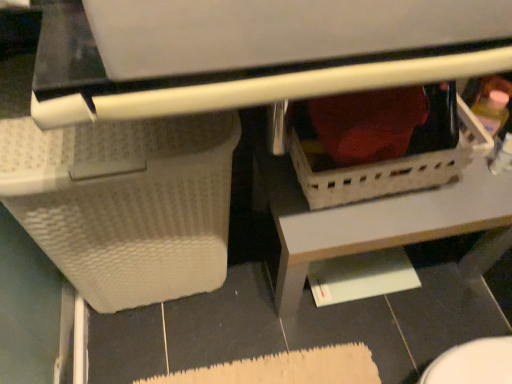
Question: Should I look upward or downward to see white textured basket at lower left, which appears as the second basket when viewed from the right?

Choices:
 (A) up
 (B) down

Answer: (B)

Question: From the image's perspective, is white textured basket at lower left, marked as the first basket in a left-to-right arrangement, over white plastic basket at center, positioned as the first basket in right-to-left order?

Choices:
 (A) no
 (B) yes

Answer: (A)

Question: Can you confirm if white textured basket at lower left, which appears as the second basket when viewed from the right, is thinner than white plastic basket at center, positioned as the first basket in right-to-left order?

Choices:
 (A) no
 (B) yes

Answer: (A)

Question: Can you confirm if white textured basket at lower left, marked as the first basket in a left-to-right arrangement, is positioned to the left of white plastic basket at center, positioned as the first basket in right-to-left order?

Choices:
 (A) yes
 (B) no

Answer: (A)

Question: Is white textured basket at lower left, marked as the first basket in a left-to-right arrangement, completely or partially outside of white plastic basket at center, positioned as the first basket in right-to-left order?

Choices:
 (A) yes
 (B) no

Answer: (A)

Question: Can you confirm if white textured basket at lower left, which appears as the second basket when viewed from the right, is wider than white plastic basket at center, positioned as the first basket in right-to-left order?

Choices:
 (A) no
 (B) yes

Answer: (B)

Question: Considering the relative positions of white textured basket at lower left, marked as the first basket in a left-to-right arrangement, and white plastic basket at center, the 2th basket when ordered from left to right, in the image provided, is white textured basket at lower left, marked as the first basket in a left-to-right arrangement, in front of white plastic basket at center, the 2th basket when ordered from left to right,?

Choices:
 (A) no
 (B) yes

Answer: (B)

Question: Does black glossy tile at lower right come in front of white plastic basket at lower center?

Choices:
 (A) yes
 (B) no

Answer: (A)

Question: Considering the relative positions of black glossy tile at lower right and white plastic basket at lower center in the image provided, is black glossy tile at lower right to the right of white plastic basket at lower center from the viewer's perspective?

Choices:
 (A) yes
 (B) no

Answer: (A)

Question: Would you say black glossy tile at lower right contains white plastic basket at lower center?

Choices:
 (A) no
 (B) yes

Answer: (A)

Question: From the image's perspective, is black glossy tile at lower right on white plastic basket at lower center?

Choices:
 (A) no
 (B) yes

Answer: (A)

Question: Is black glossy tile at lower right bigger than white plastic basket at lower center?

Choices:
 (A) no
 (B) yes

Answer: (A)

Question: Does black glossy tile at lower right have a greater width compared to white plastic basket at lower center?

Choices:
 (A) yes
 (B) no

Answer: (B)

Question: From the image's perspective, would you say white textured basket at lower left, marked as the first basket in a left-to-right arrangement, is positioned over black glossy tile at lower right?

Choices:
 (A) no
 (B) yes

Answer: (B)